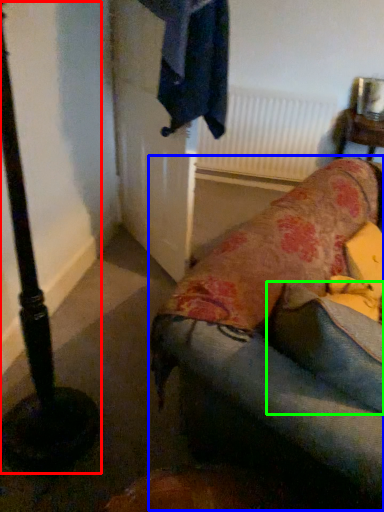
Question: Considering the real-world distances, which object is farthest from pole (highlighted by a red box)? studio couch (highlighted by a blue box) or pillow (highlighted by a green box)?

Choices:
 (A) studio couch
 (B) pillow

Answer: (B)